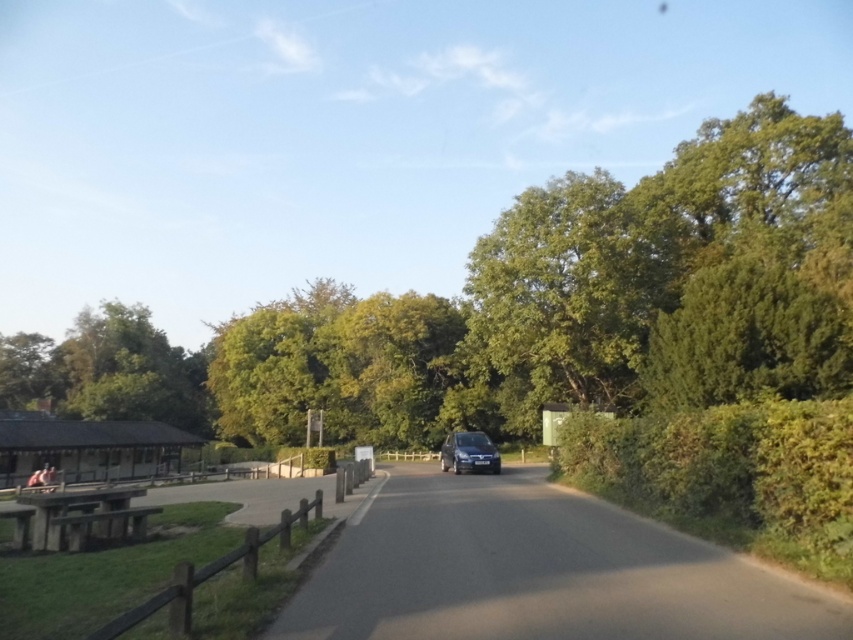
Question: Which object is positioned closest to the concrete picnic table at lower left?

Choices:
 (A) satin black car at center
 (B) black asphalt driveway at center

Answer: (B)

Question: Where is black asphalt driveway at center located in relation to concrete picnic table at lower left in the image?

Choices:
 (A) above
 (B) below

Answer: (A)

Question: Considering the relative positions of black asphalt driveway at center and concrete picnic table at lower left in the image provided, where is black asphalt driveway at center located with respect to concrete picnic table at lower left?

Choices:
 (A) below
 (B) above

Answer: (B)

Question: Which point is closer to the camera taking this photo?

Choices:
 (A) (512, 525)
 (B) (71, 547)

Answer: (A)

Question: Which object is positioned closest to the satin black car at center?

Choices:
 (A) black asphalt driveway at center
 (B) concrete picnic table at lower left

Answer: (A)

Question: Does black asphalt driveway at center appear over satin black car at center?

Choices:
 (A) yes
 (B) no

Answer: (A)